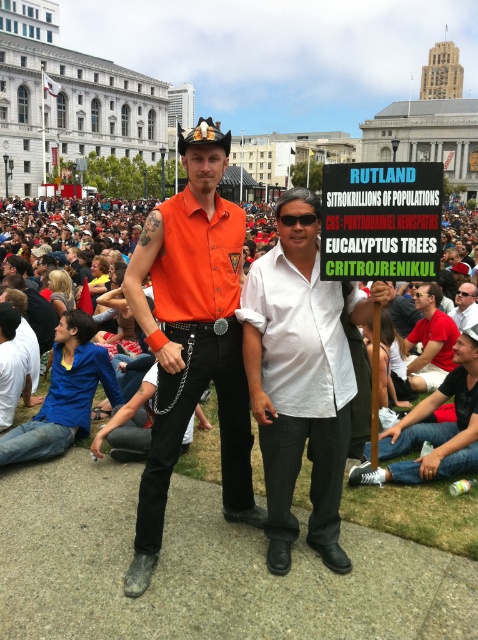
Measure the distance between point [138,355] and camera.

43.44 meters

Is matte orange shirt at center to the right of matte white shirt at center from the viewer's perspective?

No, matte orange shirt at center is not to the right of matte white shirt at center.

Where is `matte orange shirt at center`? matte orange shirt at center is located at coordinates (125, 352).

The width and height of the screenshot is (478, 640). I want to click on matte orange shirt at center, so click(125, 352).

Based on the photo, who is lower down, orange matte shirt at center or white matte shirt at center?

white matte shirt at center

Is point (205, 326) farther from viewer compared to point (355, 470)?

No.

Image resolution: width=478 pixels, height=640 pixels. What are the coordinates of `orange matte shirt at center` in the screenshot? It's located at (192, 337).

Does point (176, 324) lie in front of point (456, 316)?

Yes, point (176, 324) is closer to viewer.

Does orange matte shirt at center lie behind matte white shirt at center?

No, it is in front of matte white shirt at center.

What do you see at coordinates (192, 337) in the screenshot?
I see `orange matte shirt at center` at bounding box center [192, 337].

The width and height of the screenshot is (478, 640). What are the coordinates of `orange matte shirt at center` in the screenshot? It's located at (192, 337).